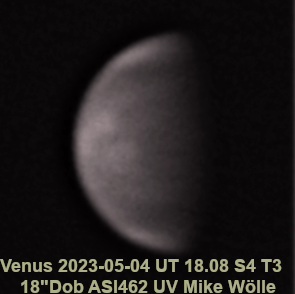
Locate an element on the screen. surface is located at coordinates (144, 231), (123, 190), (146, 68), (112, 127).